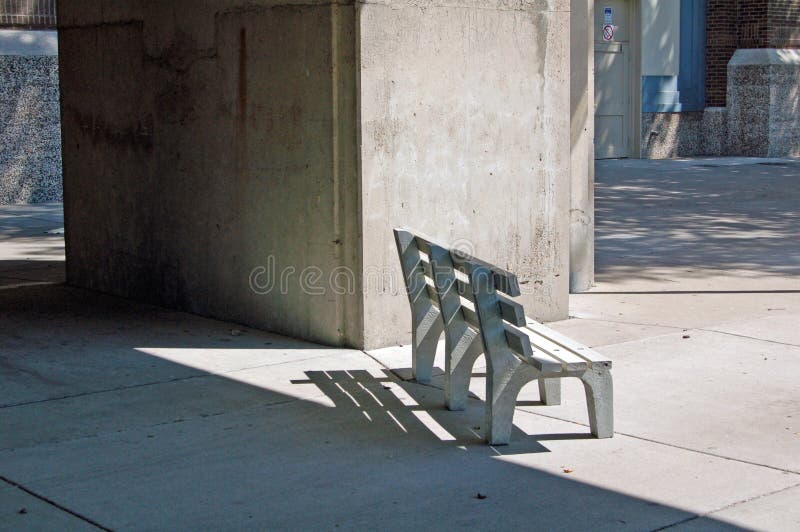
Find the location of a particular element. Image resolution: width=800 pixels, height=532 pixels. chair is located at coordinates click(502, 373).